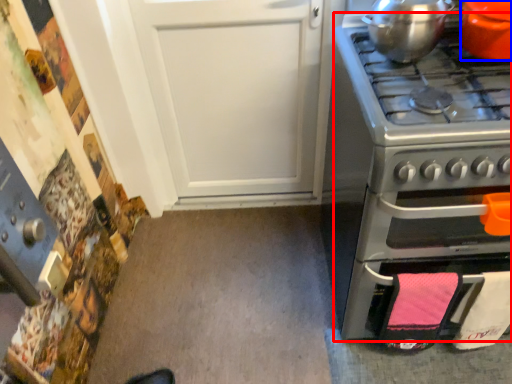
Question: Among these objects, which one is nearest to the camera, oven (highlighted by a red box) or kitchen appliance (highlighted by a blue box)?

Choices:
 (A) oven
 (B) kitchen appliance

Answer: (A)